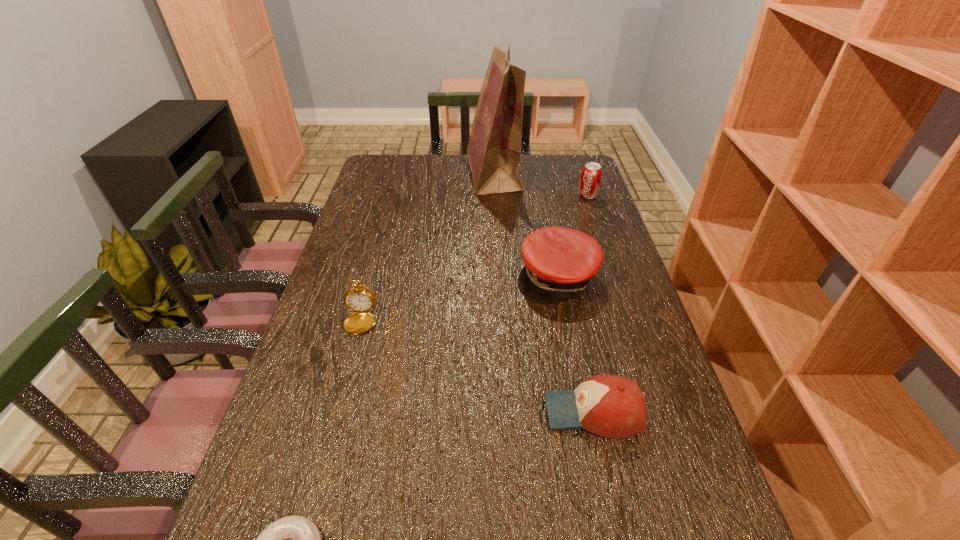
What are the coordinates of `vacant space located 0.260m on the face of the pocket watch` in the screenshot? It's located at point(343,434).

This screenshot has width=960, height=540. In order to click on vacant space located at the front of the cap where the visor is located in this screenshot , I will do `click(565, 321)`.

This screenshot has width=960, height=540. I want to click on free location located 0.220m on the front-facing side of the second nearest object, so pyautogui.click(x=441, y=412).

Locate an element on the screen. Image resolution: width=960 pixels, height=540 pixels. vacant position located on the front-facing side of the second nearest object is located at coordinates (356, 412).

The width and height of the screenshot is (960, 540). Find the location of `vacant space located 0.360m on the front-facing side of the second nearest object`. vacant space located 0.360m on the front-facing side of the second nearest object is located at coordinates (374, 412).

The height and width of the screenshot is (540, 960). Identify the location of object positioned at the far edge. click(x=494, y=148).

Image resolution: width=960 pixels, height=540 pixels. Find the location of `object that is positioned at the left edge`. object that is positioned at the left edge is located at coordinates pyautogui.click(x=359, y=299).

Where is `soda at the right edge`? The width and height of the screenshot is (960, 540). soda at the right edge is located at coordinates (591, 174).

Locate an element on the screen. The width and height of the screenshot is (960, 540). cap that is at the right edge is located at coordinates (559, 262).

Find the location of a particular element. This screenshot has height=540, width=960. baseball cap that is positioned at the right edge is located at coordinates (611, 406).